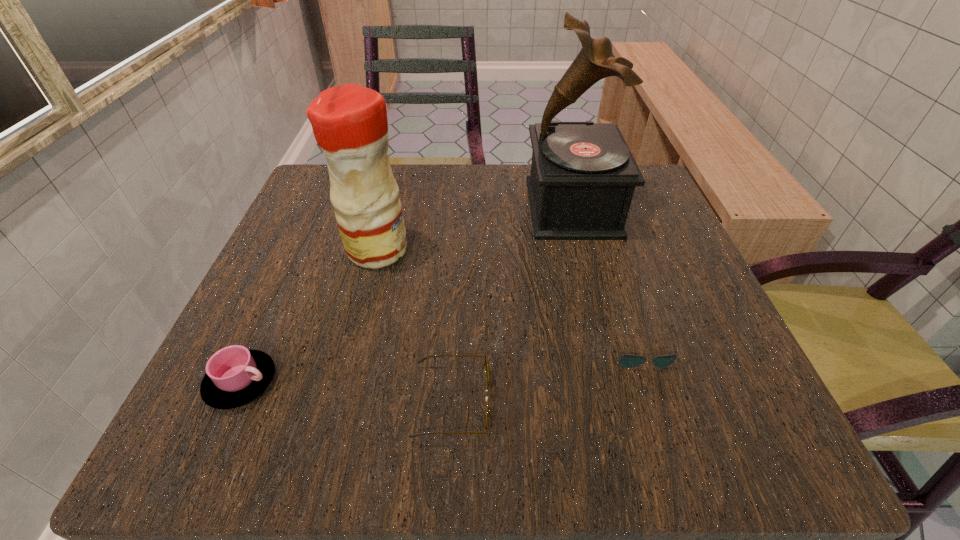
Find the location of a particular element. The width and height of the screenshot is (960, 540). vacant space situated 0.170m at the horn opening of the phonograph_record is located at coordinates (448, 207).

Locate an element on the screen. Image resolution: width=960 pixels, height=540 pixels. free space located 0.260m on the back of the condiment is located at coordinates (399, 164).

I want to click on vacant position located on the side with the handle of the leftmost object, so click(x=474, y=382).

You are a GUI agent. You are given a task and a screenshot of the screen. Output one action in this format:
    pyautogui.click(x=<x>, y=<y>)
    Task: Click on the vacant space located 0.360m on the lenses of the third object from right to left
    This screenshot has height=540, width=960.
    Given the screenshot: What is the action you would take?
    pyautogui.click(x=755, y=402)

Where is `free space located on the lenses of the shortest object`? The width and height of the screenshot is (960, 540). free space located on the lenses of the shortest object is located at coordinates (664, 428).

Locate an element on the screen. object present at the far edge is located at coordinates (583, 175).

The image size is (960, 540). Identify the location of cup positioned at the near edge. (235, 376).

At what (x,y) coordinates should I click in order to perform the action: click on sunglasses at the near edge. Please return your answer as a coordinate pair (x, y). The height and width of the screenshot is (540, 960). Looking at the image, I should click on (422, 359).

Locate an element on the screen. condiment present at the left edge is located at coordinates (349, 122).

Where is `cup present at the left edge`? cup present at the left edge is located at coordinates (235, 376).